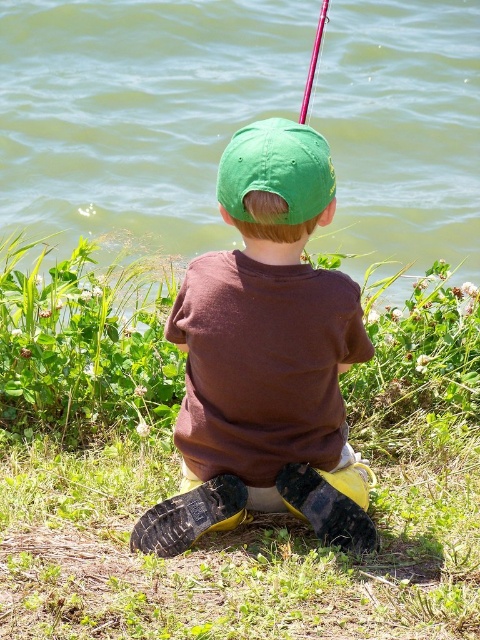
Consider the image. You are a parent trying to decide where to place a small picnic basket in the scene. The basket needs to be placed on the green grass at center and near the green water at upper center. Based on their heights, which object should the basket be placed closer to?

The green grass at center is not as tall as green water at upper center, so the picnic basket should be placed closer to the green grass at center to ensure it remains visible and accessible.

Looking at this image, you are standing at the camera position and want to place a 3 meter long fishing rod between the green matte cap at center and yourself. Is the distance sufficient to fit the fishing rod?

The distance between the green matte cap at center and the camera is 2.83 meters. Since the fishing rod is 3 meters long, it is slightly too long to fit within the available space. You would need a shorter rod or adjust your position to accommodate the length.